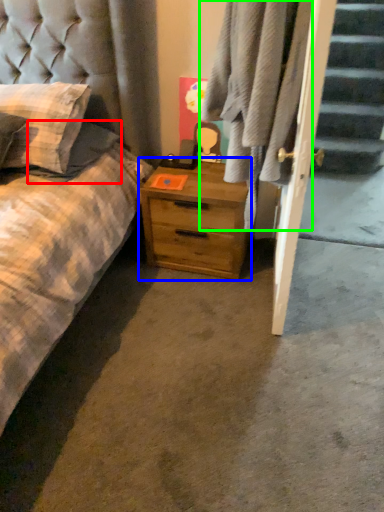
Question: Estimate the real-world distances between objects in this image. Which object is closer to pillow (highlighted by a red box), nightstand (highlighted by a blue box) or plaid (highlighted by a green box)?

Choices:
 (A) nightstand
 (B) plaid

Answer: (A)